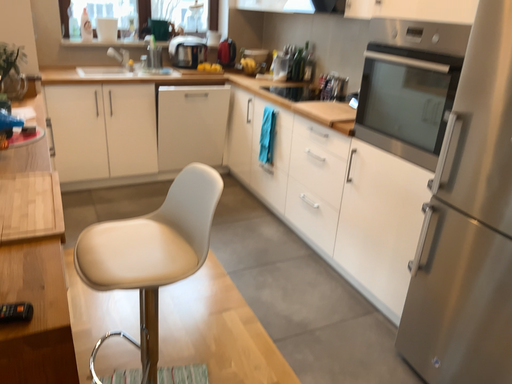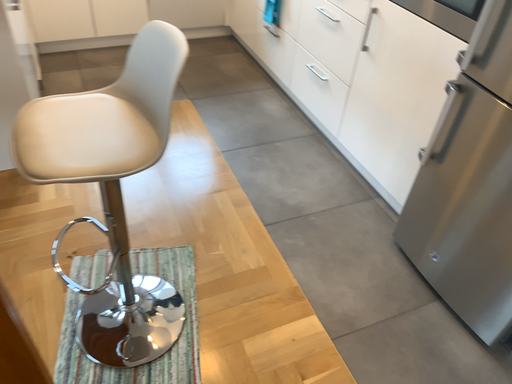
Question: Which way did the camera rotate in the video?

Choices:
 (A) rotated upward
 (B) rotated downward

Answer: (B)